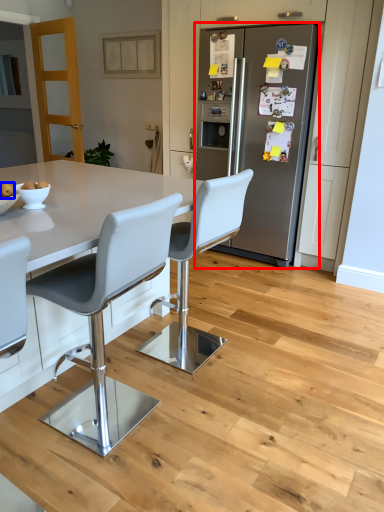
Question: Which of the following is the closest to the observer, refrigerator (highlighted by a red box) or fruit (highlighted by a blue box)?

Choices:
 (A) refrigerator
 (B) fruit

Answer: (B)